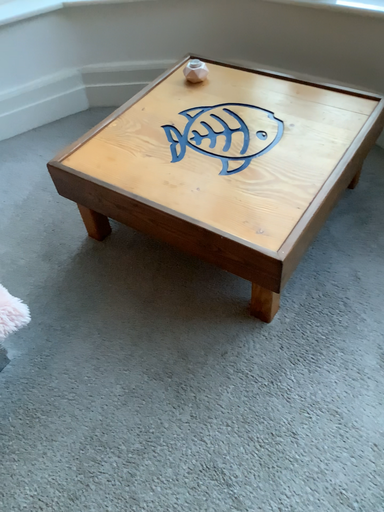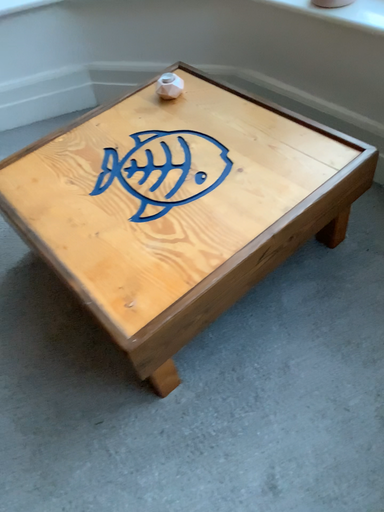
Question: How did the camera likely rotate when shooting the video?

Choices:
 (A) rotated right
 (B) rotated left

Answer: (B)